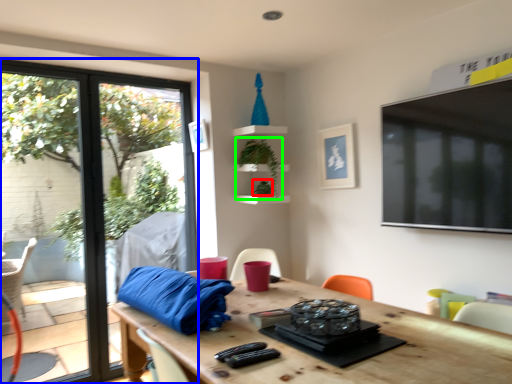
Question: Considering the real-world distances, which object is farthest from plant (highlighted by a red box)? window (highlighted by a blue box) or plant (highlighted by a green box)?

Choices:
 (A) window
 (B) plant

Answer: (A)